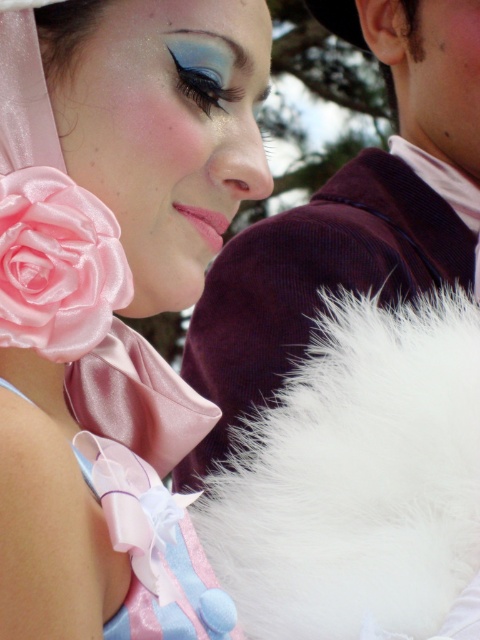
Question: Does white fluffy fur at right appear over velvet maroon coat at upper right?

Choices:
 (A) no
 (B) yes

Answer: (A)

Question: Does white fluffy fur at right have a smaller size compared to velvet maroon coat at upper right?

Choices:
 (A) no
 (B) yes

Answer: (B)

Question: Which is farther from the velvet maroon coat at upper right?

Choices:
 (A) satin pink rose at upper left
 (B) white fluffy fur at right
 (C) satin rose at left

Answer: (C)

Question: Which is farther from the velvet maroon coat at upper right?

Choices:
 (A) white fluffy fur at right
 (B) satin rose at left

Answer: (B)

Question: Can you confirm if satin pink rose at upper left is positioned to the left of satin rose at left?

Choices:
 (A) yes
 (B) no

Answer: (B)

Question: Which of these objects is positioned farthest from the velvet maroon coat at upper right?

Choices:
 (A) satin rose at left
 (B) satin pink rose at upper left
 (C) white fluffy fur at right

Answer: (A)